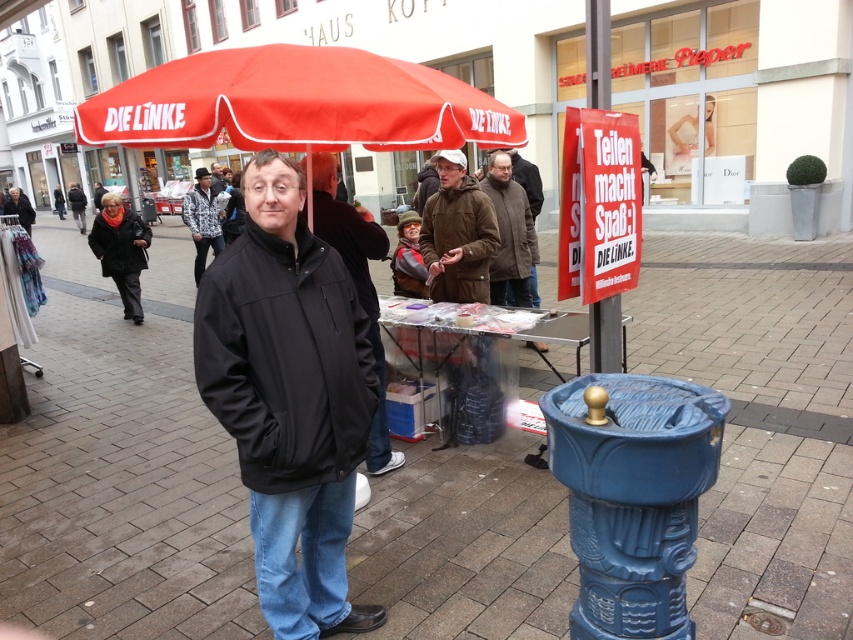
Between black matte jacket at left and white printed jacket at center, which one appears on the right side from the viewer's perspective?

Positioned to the right is white printed jacket at center.

Find the location of `black matte jacket at left`. black matte jacket at left is located at coordinates (119, 243).

Measure the distance between blue plastic water fountain at lower right and camera.

The distance of blue plastic water fountain at lower right from camera is 2.31 meters.

Locate an element on the screen. The width and height of the screenshot is (853, 640). blue plastic water fountain at lower right is located at coordinates (120, 467).

Who is more forward, (x=782, y=346) or (x=103, y=273)?

Point (x=782, y=346)

The height and width of the screenshot is (640, 853). What are the coordinates of `blue plastic water fountain at lower right` in the screenshot? It's located at (120, 467).

Who is taller, red fabric umbrella at upper center or brown woolen jacket at center?

brown woolen jacket at center is taller.

Is point (228, 109) farther from camera compared to point (473, 240)?

No, it is in front of (473, 240).

Which is behind, point (338, 88) or point (461, 198)?

The point (461, 198) is more distant.

Where is `red fabric umbrella at upper center`? red fabric umbrella at upper center is located at coordinates (296, 104).